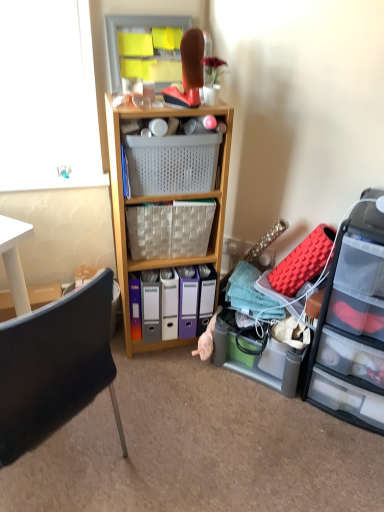
You are a GUI agent. You are given a task and a screenshot of the screen. Output one action in this format:
    pyautogui.click(x=<x>, y=<y>)
    Task: Click on the woven fabric picnic basket at center, which ranks as the 2th picnic basket in top-to-bottom order
    Image resolution: width=384 pixels, height=512 pixels.
    Given the screenshot: What is the action you would take?
    pyautogui.click(x=170, y=229)

What do you see at coordinates (352, 327) in the screenshot? The height and width of the screenshot is (512, 384). I see `clear plastic drawers at right` at bounding box center [352, 327].

What do you see at coordinates (55, 367) in the screenshot? The height and width of the screenshot is (512, 384). I see `black plastic chair at lower left` at bounding box center [55, 367].

Find the location of a particular element. woven fabric picnic basket at center, which ranks as the 2th picnic basket in top-to-bottom order is located at coordinates (170, 229).

From the picture: From a real-world perspective, is woven fabric picnic basket at center, which ranks as the 2th picnic basket in top-to-bottom order, under plastic mesh basket at center, placed as the first picnic basket when sorted from top to bottom?

Indeed, from a real-world perspective, woven fabric picnic basket at center, which ranks as the 2th picnic basket in top-to-bottom order, is positioned beneath plastic mesh basket at center, placed as the first picnic basket when sorted from top to bottom.

Which of these two, woven fabric picnic basket at center, which ranks as the 2th picnic basket in top-to-bottom order, or plastic mesh basket at center, placed as the first picnic basket when sorted from top to bottom, stands shorter?

plastic mesh basket at center, placed as the first picnic basket when sorted from top to bottom, is shorter.

Is woven fabric picnic basket at center, which ranks as the 2th picnic basket in top-to-bottom order, further to camera compared to plastic mesh basket at center, placed as the first picnic basket when sorted from top to bottom?

Yes, woven fabric picnic basket at center, which ranks as the 2th picnic basket in top-to-bottom order, is further from the camera.

Based on their positions, is woven fabric picnic basket at center, which ranks as the 2th picnic basket in top-to-bottom order, located to the left or right of plastic mesh basket at center, placed as the first picnic basket when sorted from top to bottom?

From the image, it's evident that woven fabric picnic basket at center, which ranks as the 2th picnic basket in top-to-bottom order, is to the left of plastic mesh basket at center, placed as the first picnic basket when sorted from top to bottom.

Is point (160, 264) positioned in front of point (29, 319)?

No, it is not.

Consider the image. From a real-world perspective, which is physically below, wooden shelf at center or black plastic chair at lower left?

black plastic chair at lower left.

Does wooden shelf at center have a lesser height compared to black plastic chair at lower left?

No, wooden shelf at center is not shorter than black plastic chair at lower left.

Considering the positions of objects wooden shelf at center and black plastic chair at lower left in the image provided, who is more to the right, wooden shelf at center or black plastic chair at lower left?

Positioned to the right is wooden shelf at center.

Consider the image. Does black plastic chair at lower left have a larger size compared to plastic mesh basket at center, which is counted as the 2th picnic basket, starting from the bottom?

Yes.

Does point (120, 428) lie behind point (130, 170)?

Yes, point (120, 428) is behind point (130, 170).

What's the angular difference between black plastic chair at lower left and plastic mesh basket at center, which is counted as the 2th picnic basket, starting from the bottom,'s facing directions?

They differ by 132 degrees in their facing directions.

Is wooden shelf at center not near woven fabric picnic basket at center, the first picnic basket positioned from the bottom?

No, wooden shelf at center is not far from woven fabric picnic basket at center, the first picnic basket positioned from the bottom.

Considering the positions of objects wooden shelf at center and woven fabric picnic basket at center, which ranks as the 2th picnic basket in top-to-bottom order, in the image provided, who is in front, wooden shelf at center or woven fabric picnic basket at center, which ranks as the 2th picnic basket in top-to-bottom order,?

wooden shelf at center.

Is wooden shelf at center wider or thinner than woven fabric picnic basket at center, the first picnic basket positioned from the bottom?

Considering their sizes, wooden shelf at center looks broader than woven fabric picnic basket at center, the first picnic basket positioned from the bottom.

Is wooden shelf at center bigger or smaller than woven fabric picnic basket at center, the first picnic basket positioned from the bottom?

In the image, wooden shelf at center appears to be larger than woven fabric picnic basket at center, the first picnic basket positioned from the bottom.

In the image, is plastic mesh basket at center, placed as the first picnic basket when sorted from top to bottom, on the left side or the right side of wooden shelf at center?

In the image, plastic mesh basket at center, placed as the first picnic basket when sorted from top to bottom, appears on the right side of wooden shelf at center.

From a real-world perspective, does plastic mesh basket at center, placed as the first picnic basket when sorted from top to bottom, sit lower than wooden shelf at center?

No.

From the image's perspective, is plastic mesh basket at center, which is counted as the 2th picnic basket, starting from the bottom, located beneath wooden shelf at center?

No, from the image's perspective, plastic mesh basket at center, which is counted as the 2th picnic basket, starting from the bottom, is not below wooden shelf at center.

Is clear plastic drawers at right oriented towards woven fabric picnic basket at center, which ranks as the 2th picnic basket in top-to-bottom order?

No, clear plastic drawers at right does not turn towards woven fabric picnic basket at center, which ranks as the 2th picnic basket in top-to-bottom order.

Is clear plastic drawers at right spatially inside woven fabric picnic basket at center, which ranks as the 2th picnic basket in top-to-bottom order, or outside of it?

clear plastic drawers at right is not inside woven fabric picnic basket at center, which ranks as the 2th picnic basket in top-to-bottom order, it's outside.

Between clear plastic drawers at right and woven fabric picnic basket at center, which ranks as the 2th picnic basket in top-to-bottom order, which one has larger size?

Bigger between the two is clear plastic drawers at right.

From the image's perspective, which one is positioned higher, clear plastic drawers at right or woven fabric picnic basket at center, which ranks as the 2th picnic basket in top-to-bottom order?

woven fabric picnic basket at center, which ranks as the 2th picnic basket in top-to-bottom order.

Considering the relative sizes of black plastic chair at lower left and woven fabric picnic basket at center, which ranks as the 2th picnic basket in top-to-bottom order, in the image provided, is black plastic chair at lower left thinner than woven fabric picnic basket at center, which ranks as the 2th picnic basket in top-to-bottom order,?

In fact, black plastic chair at lower left might be wider than woven fabric picnic basket at center, which ranks as the 2th picnic basket in top-to-bottom order.

Is black plastic chair at lower left looking in the opposite direction of woven fabric picnic basket at center, which ranks as the 2th picnic basket in top-to-bottom order?

black plastic chair at lower left is not turned away from woven fabric picnic basket at center, which ranks as the 2th picnic basket in top-to-bottom order.

Locate an element on the screen. This screenshot has height=512, width=384. chair below the woven fabric picnic basket at center, which ranks as the 2th picnic basket in top-to-bottom order (from the image's perspective) is located at coordinates (55, 367).

Is black plastic chair at lower left situated inside woven fabric picnic basket at center, which ranks as the 2th picnic basket in top-to-bottom order, or outside?

black plastic chair at lower left is not inside woven fabric picnic basket at center, which ranks as the 2th picnic basket in top-to-bottom order, it's outside.

Locate an element on the screen. This screenshot has height=512, width=384. picnic basket above the woven fabric picnic basket at center, the first picnic basket positioned from the bottom (from the image's perspective) is located at coordinates (172, 163).

Identify the location of shelf above the black plastic chair at lower left (from a real-world perspective). click(158, 202).

Looking at the image, which one is located further to wooden shelf at center, plastic mesh basket at center, which is counted as the 2th picnic basket, starting from the bottom, or black plastic chair at lower left?

The object further to wooden shelf at center is black plastic chair at lower left.

From the image, which object appears to be farther from black plastic chair at lower left, wooden shelf at center or clear plastic drawers at right?

clear plastic drawers at right is further to black plastic chair at lower left.

When comparing their distances from woven fabric picnic basket at center, which ranks as the 2th picnic basket in top-to-bottom order, does black plastic chair at lower left or wooden shelf at center seem further?

black plastic chair at lower left lies further to woven fabric picnic basket at center, which ranks as the 2th picnic basket in top-to-bottom order, than the other object.

Considering their positions, is clear plastic drawers at right positioned further to black plastic chair at lower left than plastic mesh basket at center, placed as the first picnic basket when sorted from top to bottom?

Among the two, clear plastic drawers at right is located further to black plastic chair at lower left.

Considering their positions, is woven fabric picnic basket at center, which ranks as the 2th picnic basket in top-to-bottom order, positioned further to wooden shelf at center than plastic mesh basket at center, placed as the first picnic basket when sorted from top to bottom?

The object further to wooden shelf at center is plastic mesh basket at center, placed as the first picnic basket when sorted from top to bottom.

In the scene shown: From the image, which object appears to be farther from clear plastic drawers at right, wooden shelf at center or plastic mesh basket at center, which is counted as the 2th picnic basket, starting from the bottom?

plastic mesh basket at center, which is counted as the 2th picnic basket, starting from the bottom, is positioned further to the anchor clear plastic drawers at right.

Which object lies nearer to the anchor point plastic mesh basket at center, placed as the first picnic basket when sorted from top to bottom, woven fabric picnic basket at center, which ranks as the 2th picnic basket in top-to-bottom order, or black plastic chair at lower left?

woven fabric picnic basket at center, which ranks as the 2th picnic basket in top-to-bottom order.

Based on their spatial positions, is woven fabric picnic basket at center, the first picnic basket positioned from the bottom, or black plastic chair at lower left closer to wooden shelf at center?

Based on the image, woven fabric picnic basket at center, the first picnic basket positioned from the bottom, appears to be nearer to wooden shelf at center.

Find the location of a particular element. The width and height of the screenshot is (384, 512). shelf located between black plastic chair at lower left and woven fabric picnic basket at center, which ranks as the 2th picnic basket in top-to-bottom order, in the depth direction is located at coordinates (158, 202).

This screenshot has height=512, width=384. Find the location of `picnic basket between woven fabric picnic basket at center, the first picnic basket positioned from the bottom, and clear plastic drawers at right, in the horizontal direction`. picnic basket between woven fabric picnic basket at center, the first picnic basket positioned from the bottom, and clear plastic drawers at right, in the horizontal direction is located at coordinates (172, 163).

I want to click on shelf between woven fabric picnic basket at center, the first picnic basket positioned from the bottom, and clear plastic drawers at right, so click(158, 202).

Identify the location of picnic basket situated between wooden shelf at center and clear plastic drawers at right from left to right. (172, 163).